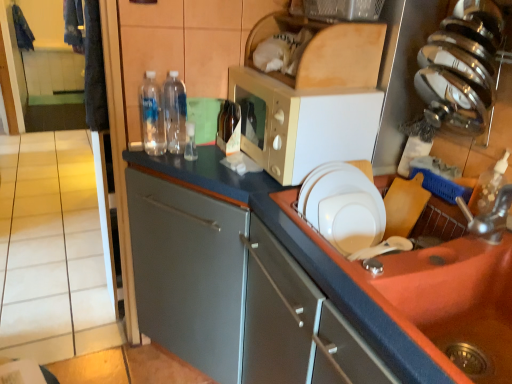
Identify the location of vacant area that is in front of brown glass bottle at center, which is the 1th bottle in right-to-left order. This screenshot has height=384, width=512. (217, 160).